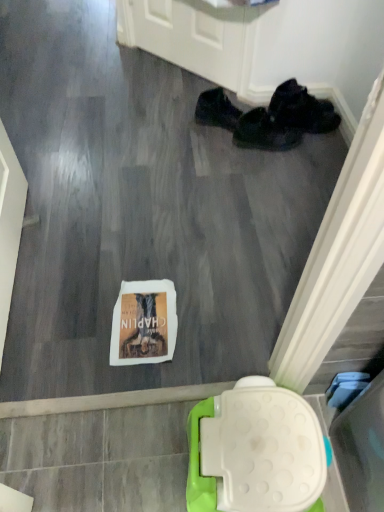
At what (x,y) coordinates should I click in order to perform the action: click on vacant area to the left of black fabric shoe at upper right, which appears as the first footwear when viewed from the left. Please return your answer as a coordinate pair (x, y). This screenshot has width=384, height=512. Looking at the image, I should click on coord(172,124).